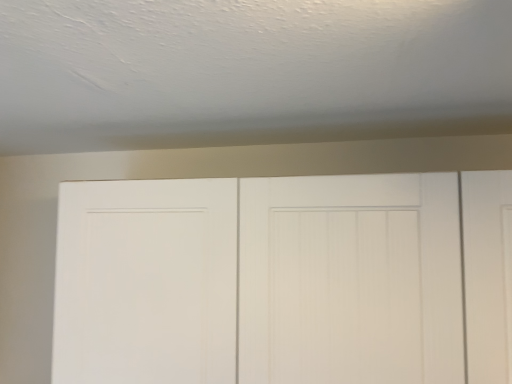
What do you see at coordinates (283, 279) in the screenshot?
I see `white matte door at center` at bounding box center [283, 279].

Measure the distance between white matte door at center and camera.

A distance of 34.46 inches exists between white matte door at center and camera.

Locate an element on the screen. white matte door at center is located at coordinates (283, 279).

Identify the location of white matte door at center. This screenshot has width=512, height=384. (283, 279).